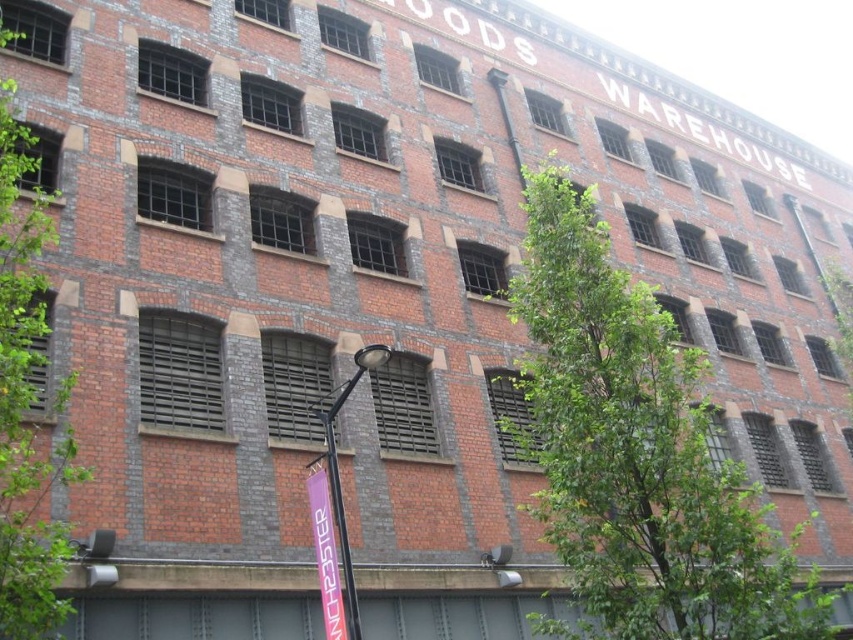
Where is `green leafy tree at center`? The height and width of the screenshot is (640, 853). green leafy tree at center is located at coordinates (637, 452).

What do you see at coordinates (637, 452) in the screenshot? I see `green leafy tree at center` at bounding box center [637, 452].

Between point (601, 387) and point (332, 612), which one is positioned in front?

Positioned in front is point (332, 612).

The width and height of the screenshot is (853, 640). Find the location of `green leafy tree at center`. green leafy tree at center is located at coordinates (637, 452).

Does black metal lamp post at center appear over metallic signpost at center?

Yes, black metal lamp post at center is above metallic signpost at center.

Between black metal lamp post at center and metallic signpost at center, which one has more height?

With more height is black metal lamp post at center.

This screenshot has height=640, width=853. Identify the location of black metal lamp post at center. (338, 472).

Does point (328, 502) lie in front of point (350, 593)?

No, it is behind (350, 593).

Who is more distant from viewer, (x=323, y=541) or (x=347, y=548)?

Positioned behind is point (x=323, y=541).

Where is `pink fabric banner at lower center`? pink fabric banner at lower center is located at coordinates point(325,554).